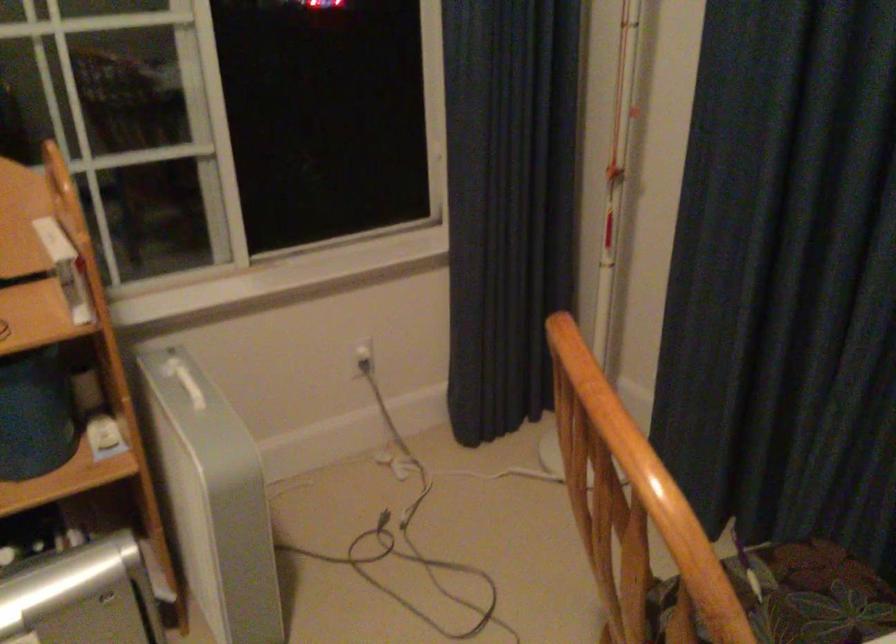
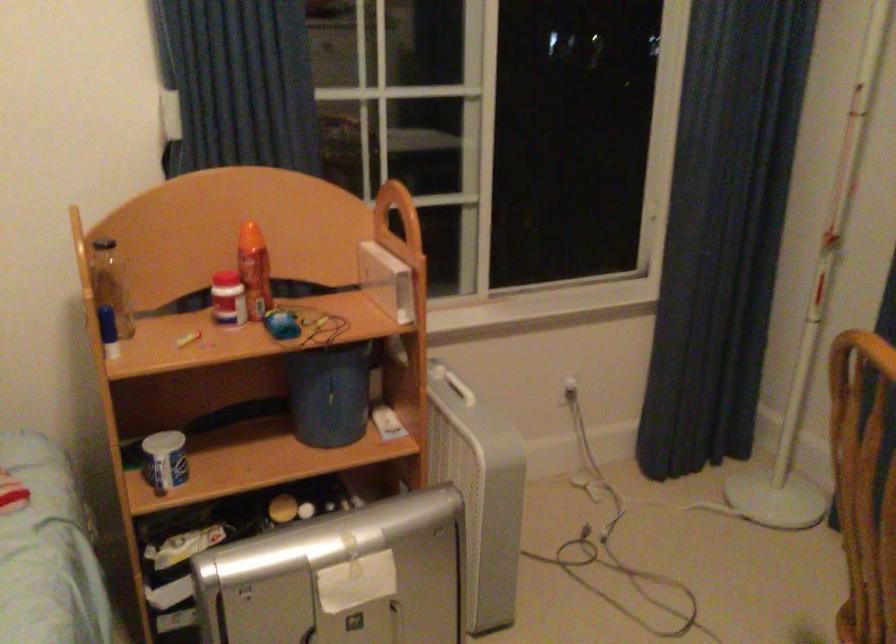
Where in the second image is the point corresponding to the point at 352,366 from the first image?

(564, 392)